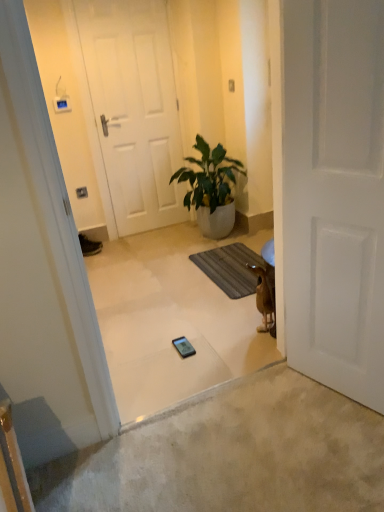
Locate an element on the screen. vacant area that lies in front of brown furry dog at lower right is located at coordinates (258, 349).